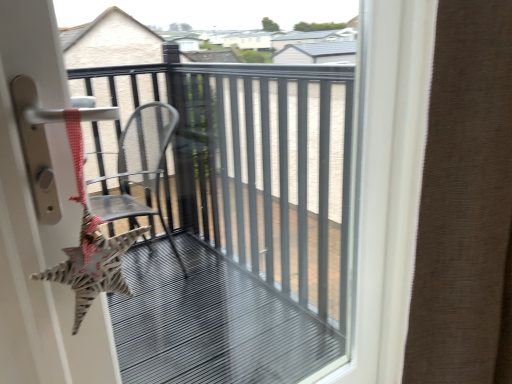
What do you see at coordinates (234, 166) in the screenshot? I see `metallic gray chair at center` at bounding box center [234, 166].

Find the location of `metallic gray chair at center`. metallic gray chair at center is located at coordinates (234, 166).

The image size is (512, 384). Describe the element at coordinates (466, 204) in the screenshot. I see `brown textured curtain at right` at that location.

Where is `brown textured curtain at right`? This screenshot has width=512, height=384. brown textured curtain at right is located at coordinates (466, 204).

At what (x,y) coordinates should I click in order to perform the action: click on metallic gray chair at center. Please return your answer as a coordinate pair (x, y). The image size is (512, 384). Looking at the image, I should click on (234, 166).

Considering the relative positions of metallic gray chair at center and brown textured curtain at right in the image provided, is metallic gray chair at center to the left of brown textured curtain at right from the viewer's perspective?

Correct, you'll find metallic gray chair at center to the left of brown textured curtain at right.

Which object is further away from the camera, metallic gray chair at center or brown textured curtain at right?

metallic gray chair at center is further away from the camera.

Considering the points (156, 73) and (489, 134), which point is behind, point (156, 73) or point (489, 134)?

The point (156, 73) is farther.

From the image's perspective, which is below, metallic gray chair at center or brown textured curtain at right?

From the image's view, metallic gray chair at center is below.

From a real-world perspective, does metallic gray chair at center sit lower than brown textured curtain at right?

Indeed, from a real-world perspective, metallic gray chair at center is positioned beneath brown textured curtain at right.

Which object is wider, metallic gray chair at center or brown textured curtain at right?

With larger width is brown textured curtain at right.

Considering the sizes of metallic gray chair at center and brown textured curtain at right in the image, is metallic gray chair at center taller or shorter than brown textured curtain at right?

Clearly, metallic gray chair at center is taller compared to brown textured curtain at right.

Does metallic gray chair at center have a larger size compared to brown textured curtain at right?

Incorrect, metallic gray chair at center is not larger than brown textured curtain at right.

Can brown textured curtain at right be found inside metallic gray chair at center?

Definitely not — brown textured curtain at right is not inside metallic gray chair at center.

Is there a large distance between metallic gray chair at center and brown textured curtain at right?

No, metallic gray chair at center is in close proximity to brown textured curtain at right.

Is metallic gray chair at center aimed at brown textured curtain at right?

Yes, metallic gray chair at center is oriented towards brown textured curtain at right.

Image resolution: width=512 pixels, height=384 pixels. I want to click on curtain above the metallic gray chair at center (from a real-world perspective), so click(466, 204).

Can you confirm if brown textured curtain at right is positioned to the right of metallic gray chair at center?

Yes.

Relative to metallic gray chair at center, is brown textured curtain at right in front or behind?

In the image, brown textured curtain at right appears in front of metallic gray chair at center.

Does point (455, 85) lie behind point (328, 254)?

No, (455, 85) is closer to viewer.

From the image's perspective, which one is positioned lower, brown textured curtain at right or metallic gray chair at center?

metallic gray chair at center appears lower in the image.

From a real-world perspective, which is physically below, brown textured curtain at right or metallic gray chair at center?

metallic gray chair at center is physically lower.

Considering the relative sizes of brown textured curtain at right and metallic gray chair at center in the image provided, is brown textured curtain at right thinner than metallic gray chair at center?

No.

Who is taller, brown textured curtain at right or metallic gray chair at center?

metallic gray chair at center.

Considering the sizes of objects brown textured curtain at right and metallic gray chair at center in the image provided, who is bigger, brown textured curtain at right or metallic gray chair at center?

With larger size is brown textured curtain at right.

Is brown textured curtain at right positioned beyond the bounds of metallic gray chair at center?

brown textured curtain at right is positioned outside metallic gray chair at center.

Would you say brown textured curtain at right is a long distance from metallic gray chair at center?

No.

Is brown textured curtain at right looking in the opposite direction of metallic gray chair at center?

No, brown textured curtain at right's orientation is not away from metallic gray chair at center.

Can you tell me how much brown textured curtain at right and metallic gray chair at center differ in facing direction?

There is a 6.89-degree angle between the facing directions of brown textured curtain at right and metallic gray chair at center.

Image resolution: width=512 pixels, height=384 pixels. In order to click on curtain in front of the metallic gray chair at center in this screenshot , I will do `click(466, 204)`.

Find the location of a particular element. Image resolution: width=512 pixels, height=384 pixels. balcony on the left of brown textured curtain at right is located at coordinates (234, 166).

Locate an element on the screen. The height and width of the screenshot is (384, 512). curtain located on the right of metallic gray chair at center is located at coordinates (466, 204).